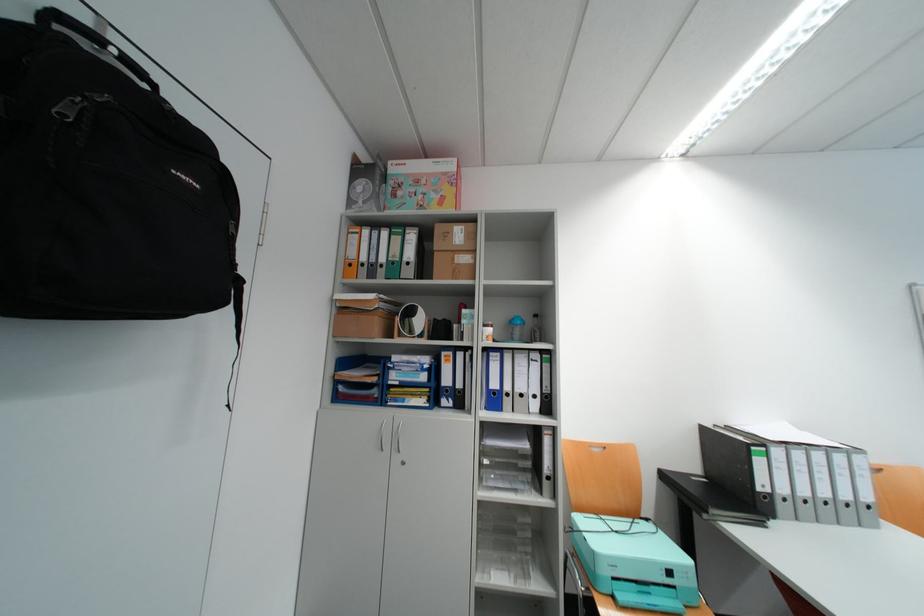
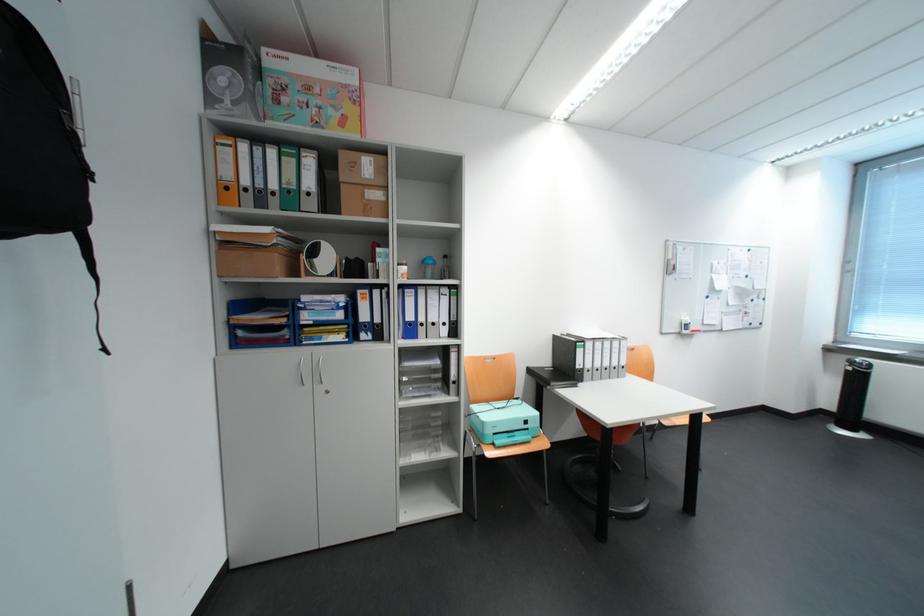
Where in the second image is the point corresponding to point 444,280 from the first image?

(351, 215)